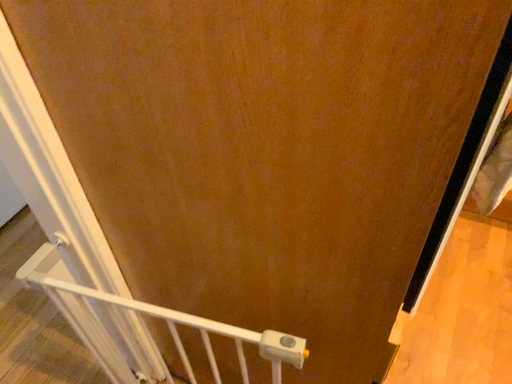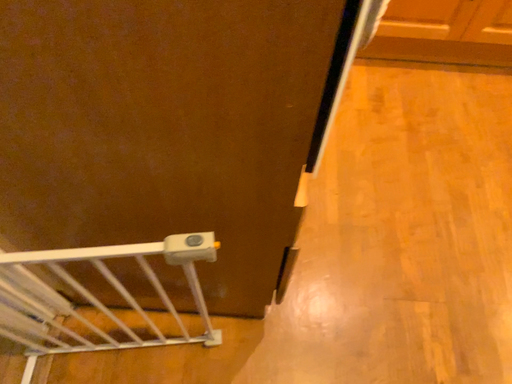
Question: Which way did the camera rotate in the video?

Choices:
 (A) rotated right
 (B) rotated left

Answer: (A)